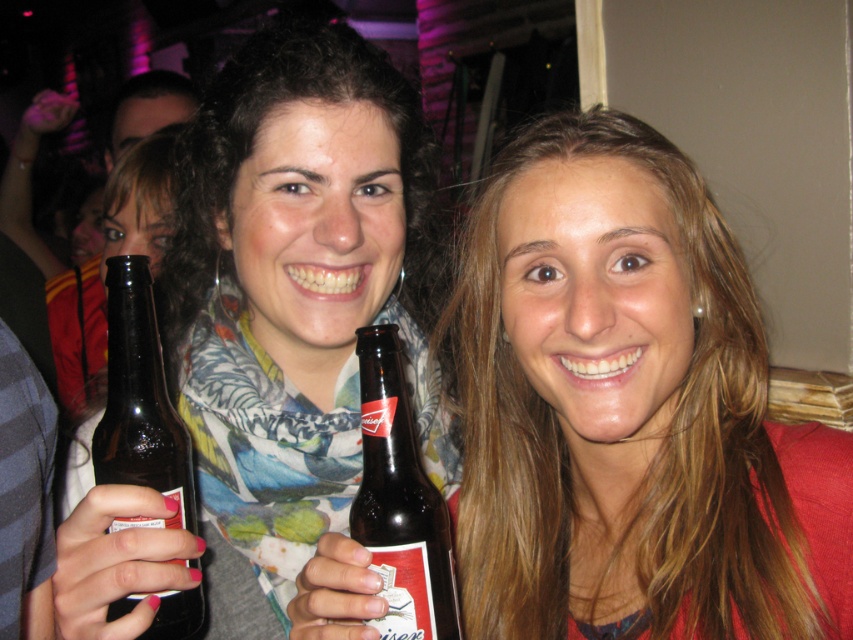
Question: Does matte brown bottle at center have a lesser width compared to brown glass bottle at bottle left?

Choices:
 (A) no
 (B) yes

Answer: (A)

Question: Which object is closer to the camera taking this photo?

Choices:
 (A) brown glass beer bottle at center
 (B) matte black bottle at left

Answer: (A)

Question: Among these points, which one is farthest from the camera?

Choices:
 (A) (368, 349)
 (B) (155, 362)
 (C) (344, 80)

Answer: (C)

Question: Is matte black bottle at left wider than brown glass bottle at bottle left?

Choices:
 (A) no
 (B) yes

Answer: (B)

Question: Based on their relative distances, which object is nearer to the brown glass beer bottle at center?

Choices:
 (A) brown glass bottle at bottle left
 (B) matte brown bottle at center

Answer: (A)

Question: Considering the relative positions of matte brown bottle at center and brown glass bottle at bottle left in the image provided, where is matte brown bottle at center located with respect to brown glass bottle at bottle left?

Choices:
 (A) left
 (B) right

Answer: (B)